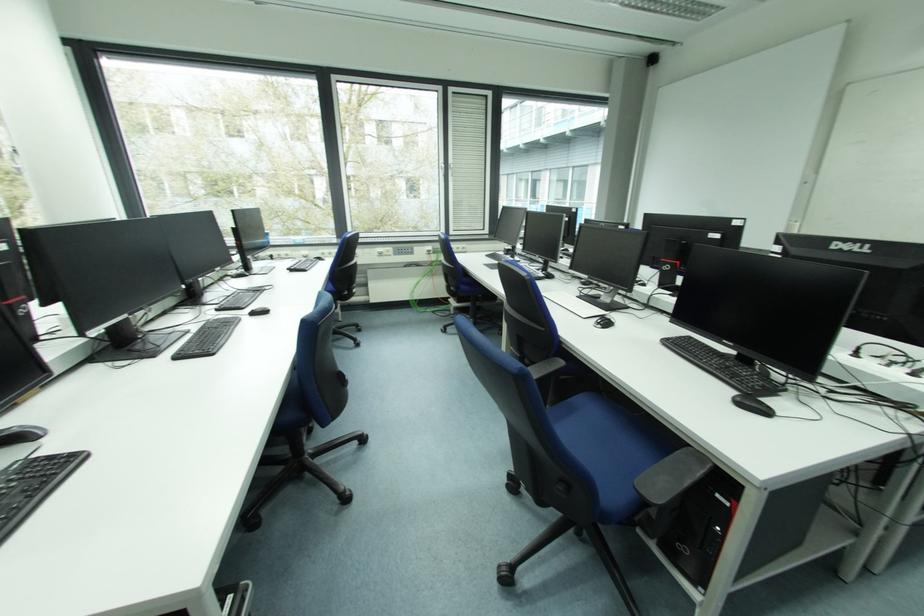
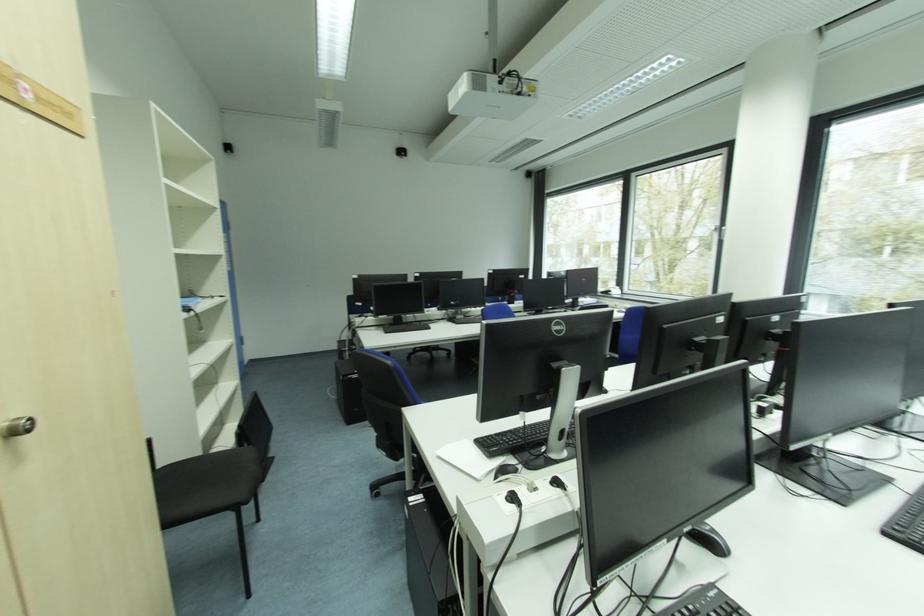
Question: The camera is either moving clockwise (left) or counter-clockwise (right) around the object. The first image is from the beginning of the video and the second image is from the end. Is the camera moving left or right when shooting the video?

Choices:
 (A) Left
 (B) Right

Answer: (B)